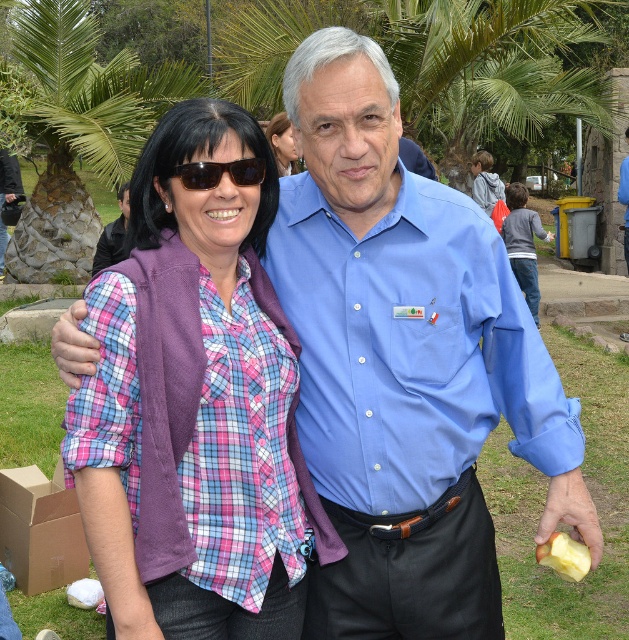
You are standing in the park and want to determine which of the two points, point (125, 241) or point (281, 163), is closer to you. Based on the scene description, which point is nearer?

Point (125, 241) is closer to the viewer than point (281, 163).

Where is the plaid fabric shirt at center located in the image?

The plaid fabric shirt at center is located at point (201, 358).

You are a fashion designer observing two elements in the park scene. You need to decide which item of clothing is smaller in size between the matte purple vest at center and the matte black hair at upper center. Which one is smaller?

The matte purple vest at center has a smaller size compared to the matte black hair at upper center, so the matte purple vest at center is smaller.